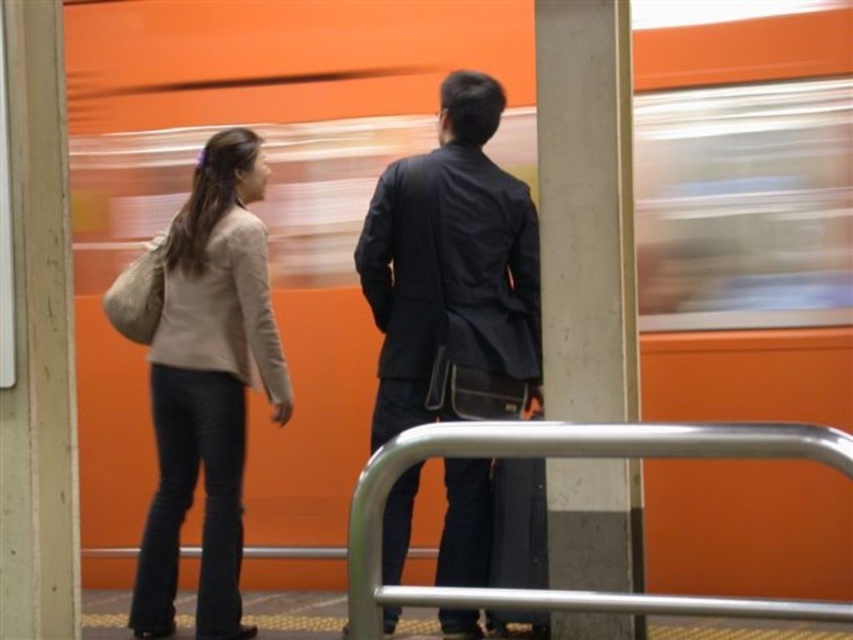
You are a photographer trying to capture a candid shot of the matte black jacket at center and the silver metallic rail at center in the subway station scene. Based on their heights, which object should you adjust your camera angle to focus on first?

The matte black jacket at center is much taller than the silver metallic rail at center, so you should focus on the matte black jacket at center first to ensure it is properly framed in the shot.

You are a security guard in the subway station. You need to locate the matte black jacket at center. Where exactly is it positioned in the scene?

The matte black jacket at center is located at point coordinates of (451,273).

You are standing at the point marked as point (431, 349) in the subway station. You want to walk to the nearest exit, which is located 5 meters away from your current position. Can you reach the exit without moving more than 5 meters?

The distance between point (431, 349) and the viewer is 3.89 meters. Since the exit is 5 meters away from your current position, you can reach it without moving more than 5 meters because 3.89 meters is less than 5 meters.